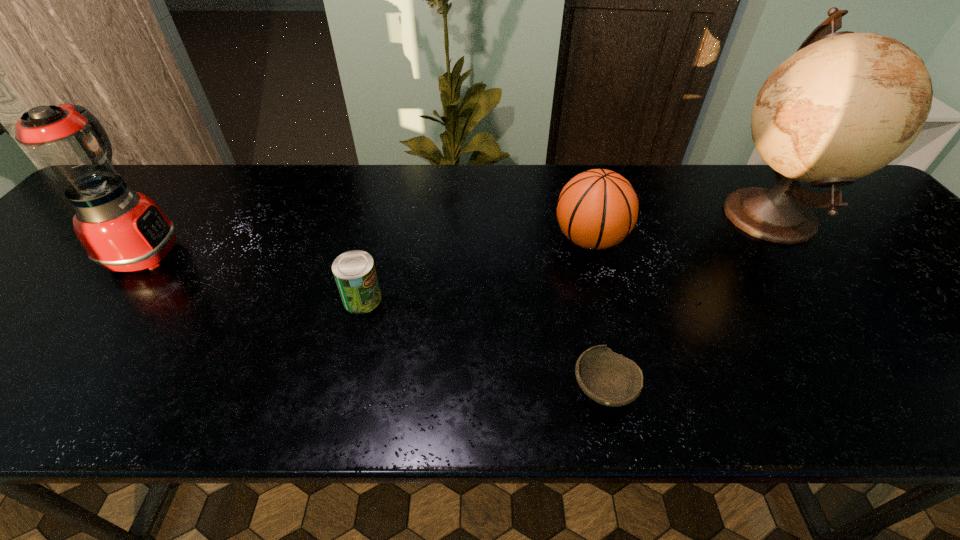
You are a GUI agent. You are given a task and a screenshot of the screen. Output one action in this format:
    pyautogui.click(x=<x>, y=<y>)
    Task: Click on the vacant space that satisfies the following two spatial constraints: 1. on the controls of the can; 2. on the right side of the leftmost object
    
    Given the screenshot: What is the action you would take?
    pyautogui.click(x=110, y=299)